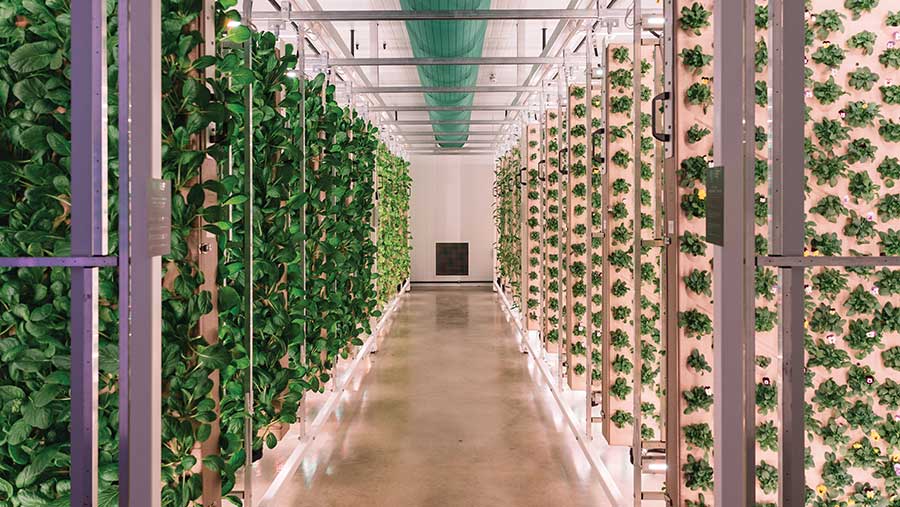
Locate an element on the screen. doorway is located at coordinates (723, 373).